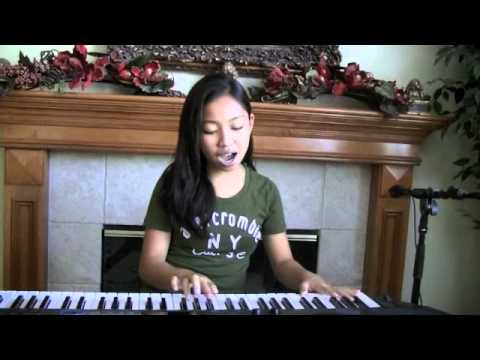
I want to click on cord, so click(414, 212).